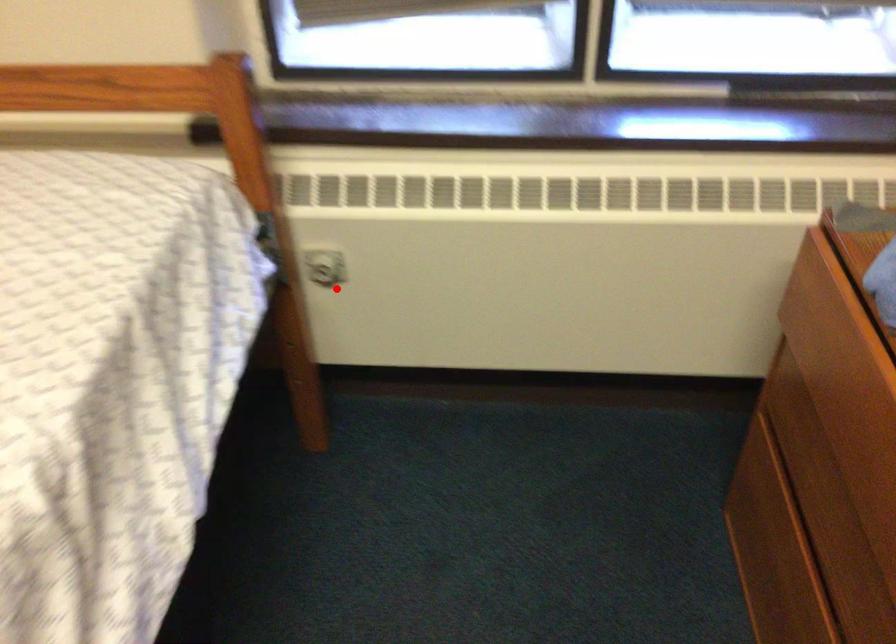
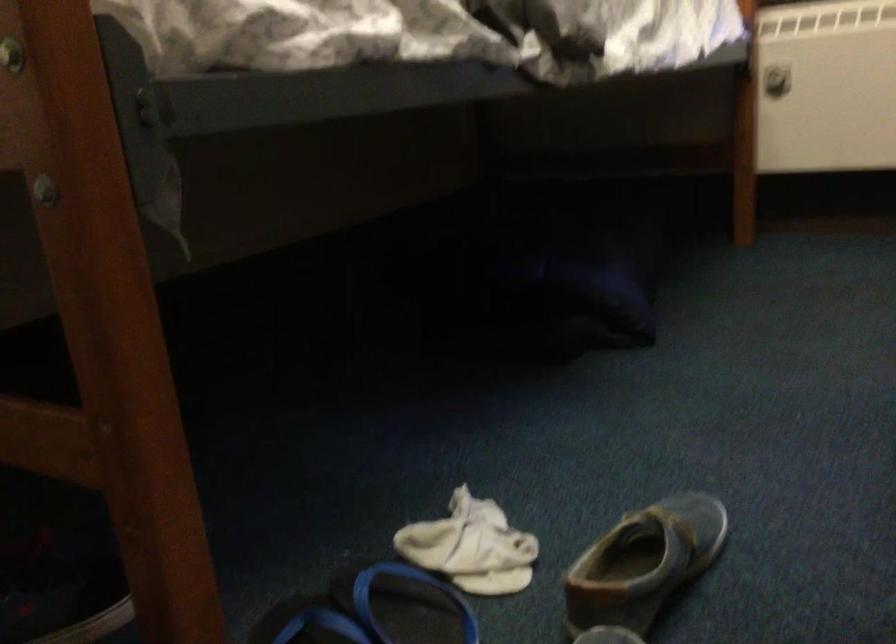
Locate, in the second image, the point that corresponds to the highlighted location in the first image.

(776, 80)